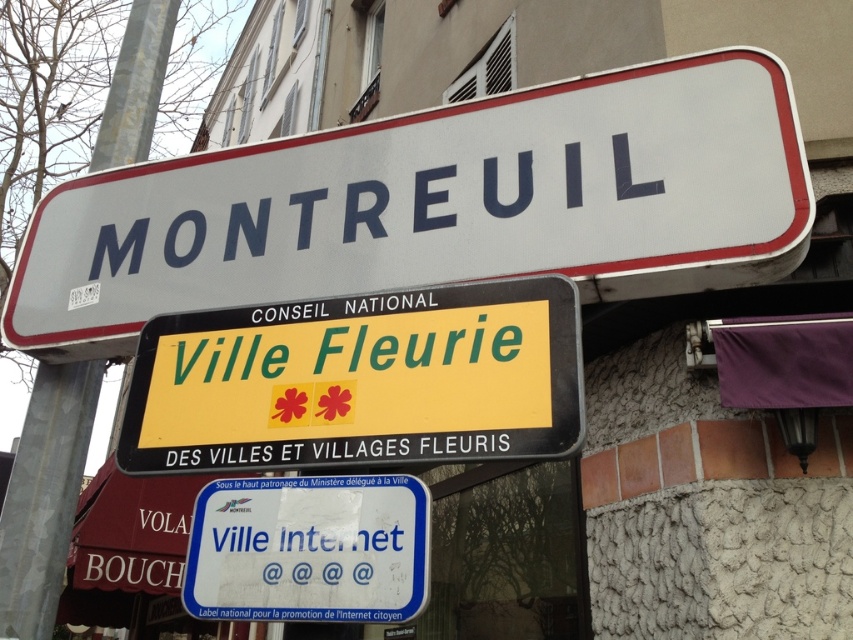
Can you confirm if yellow matte signboard at center is positioned to the left of metallic pole at upper center?

In fact, yellow matte signboard at center is to the right of metallic pole at upper center.

What do you see at coordinates (360, 381) in the screenshot? This screenshot has width=853, height=640. I see `yellow matte signboard at center` at bounding box center [360, 381].

Where is `yellow matte signboard at center`? yellow matte signboard at center is located at coordinates (360, 381).

Find the location of a particular element. yellow matte signboard at center is located at coordinates (360, 381).

Which of these two, yellow matte signboard at center or blue plastic sign at center, stands shorter?

blue plastic sign at center is shorter.

The image size is (853, 640). What do you see at coordinates (360, 381) in the screenshot? I see `yellow matte signboard at center` at bounding box center [360, 381].

This screenshot has height=640, width=853. I want to click on yellow matte signboard at center, so (x=360, y=381).

Does blue plastic sign at center have a lesser width compared to metallic pole at upper center?

No.

Can you confirm if blue plastic sign at center is wider than metallic pole at upper center?

Indeed, blue plastic sign at center has a greater width compared to metallic pole at upper center.

You are a GUI agent. You are given a task and a screenshot of the screen. Output one action in this format:
    pyautogui.click(x=<x>, y=<y>)
    Task: Click on the blue plastic sign at center
    The height and width of the screenshot is (640, 853).
    Given the screenshot: What is the action you would take?
    pyautogui.click(x=309, y=548)

At what (x,y) coordinates should I click in order to perform the action: click on blue plastic sign at center. Please return your answer as a coordinate pair (x, y). This screenshot has width=853, height=640. Looking at the image, I should click on (309, 548).